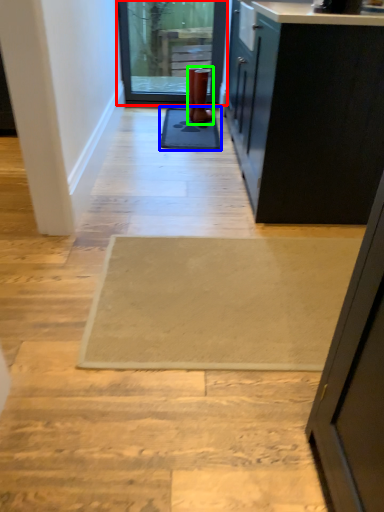
Question: Considering the real-world distances, which object is farthest from door (highlighted by a red box)? mat (highlighted by a blue box) or boot (highlighted by a green box)?

Choices:
 (A) mat
 (B) boot

Answer: (A)